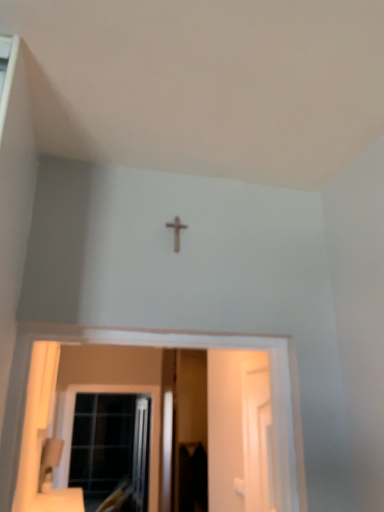
Question: Considering the relative positions of white glossy screen door at right, acting as the first screen door starting from the front, and transparent plastic screen door at center, which appears as the 1th screen door when viewed from the back, in the image provided, is white glossy screen door at right, acting as the first screen door starting from the front, to the right of transparent plastic screen door at center, which appears as the 1th screen door when viewed from the back, from the viewer's perspective?

Choices:
 (A) yes
 (B) no

Answer: (A)

Question: Does white glossy screen door at right, the second screen door positioned from the left, have a lesser height compared to transparent plastic screen door at center, which ranks as the second screen door in right-to-left order?

Choices:
 (A) no
 (B) yes

Answer: (B)

Question: Is white glossy screen door at right, the 1th screen door when ordered from right to left, at the left side of transparent plastic screen door at center, arranged as the first screen door when viewed from the left?

Choices:
 (A) no
 (B) yes

Answer: (A)

Question: Is white glossy screen door at right, the 2th screen door from the back, in contact with transparent plastic screen door at center, arranged as the first screen door when viewed from the left?

Choices:
 (A) yes
 (B) no

Answer: (B)

Question: Is transparent plastic screen door at center, which ranks as the second screen door in right-to-left order, completely or partially inside white glossy screen door at right, the 2th screen door from the back?

Choices:
 (A) yes
 (B) no

Answer: (B)

Question: From the image's perspective, relative to transparent plastic screen door at center, which ranks as the second screen door in front-to-back order, is clear glass window at lower left above or below?

Choices:
 (A) below
 (B) above

Answer: (A)

Question: Considering the positions of clear glass window at lower left and transparent plastic screen door at center, which appears as the 1th screen door when viewed from the back, in the image, is clear glass window at lower left wider or thinner than transparent plastic screen door at center, which appears as the 1th screen door when viewed from the back,?

Choices:
 (A) thin
 (B) wide

Answer: (A)

Question: Which is correct: clear glass window at lower left is inside transparent plastic screen door at center, which appears as the 1th screen door when viewed from the back, or outside of it?

Choices:
 (A) inside
 (B) outside

Answer: (B)

Question: Considering the positions of point coord(137,458) and point coord(177,352), is point coord(137,458) closer or farther from the camera than point coord(177,352)?

Choices:
 (A) closer
 (B) farther

Answer: (B)

Question: Based on their positions, is white glossy screen door at right, the 2th screen door from the back, located to the left or right of clear glass window at lower left?

Choices:
 (A) right
 (B) left

Answer: (A)

Question: In terms of size, does white glossy screen door at right, the 1th screen door when ordered from right to left, appear bigger or smaller than clear glass window at lower left?

Choices:
 (A) big
 (B) small

Answer: (B)

Question: Is white glossy screen door at right, the 1th screen door when ordered from right to left, inside the boundaries of clear glass window at lower left, or outside?

Choices:
 (A) inside
 (B) outside

Answer: (B)

Question: Is white glossy screen door at right, the 2th screen door from the back, in front of or behind clear glass window at lower left in the image?

Choices:
 (A) behind
 (B) front

Answer: (B)

Question: Is wooden cross at center spatially inside white glossy screen door at right, acting as the first screen door starting from the front, or outside of it?

Choices:
 (A) outside
 (B) inside

Answer: (A)

Question: From the image's perspective, is wooden cross at center located above or below white glossy screen door at right, the 2th screen door from the back?

Choices:
 (A) below
 (B) above

Answer: (B)